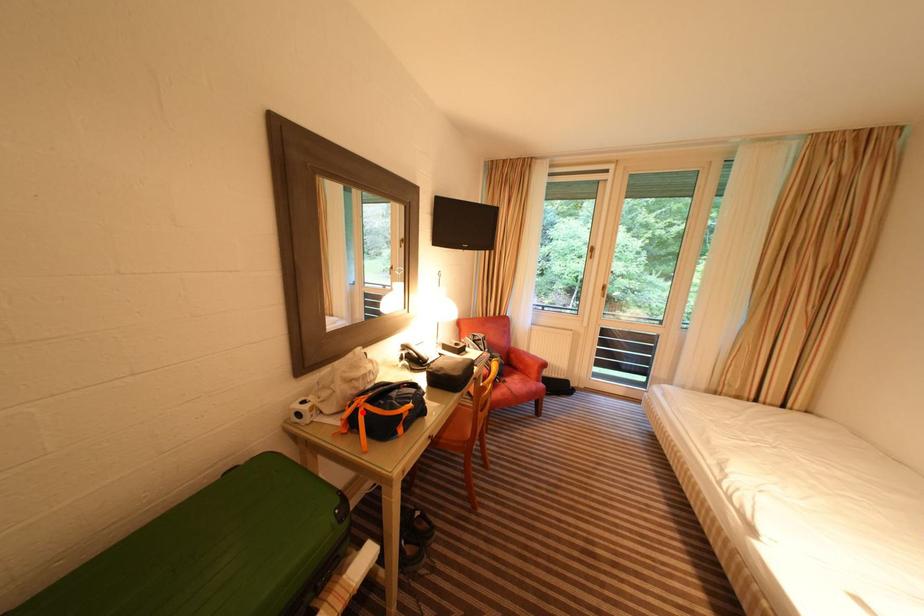
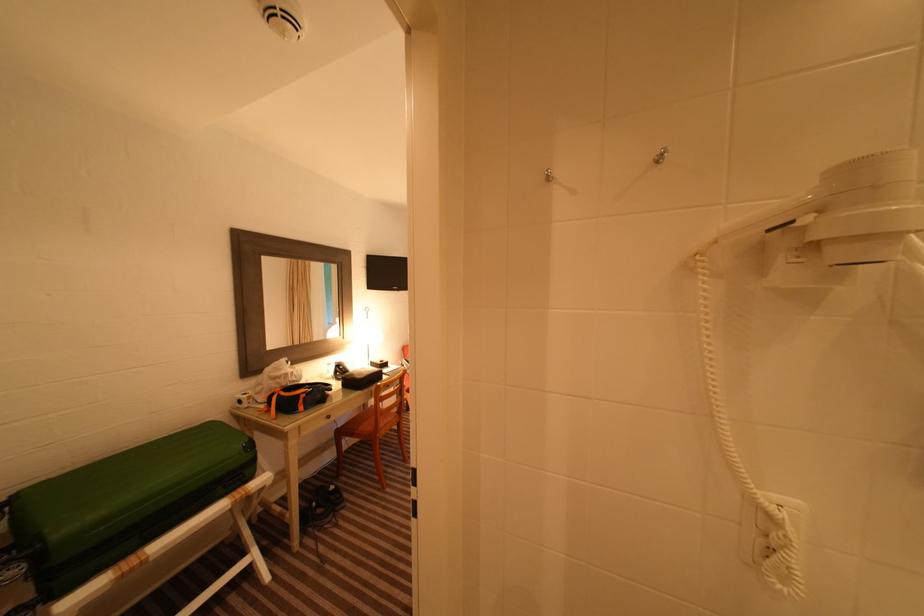
Locate, in the second image, the point that corresponds to the highlighted location in the first image.

(280, 397)